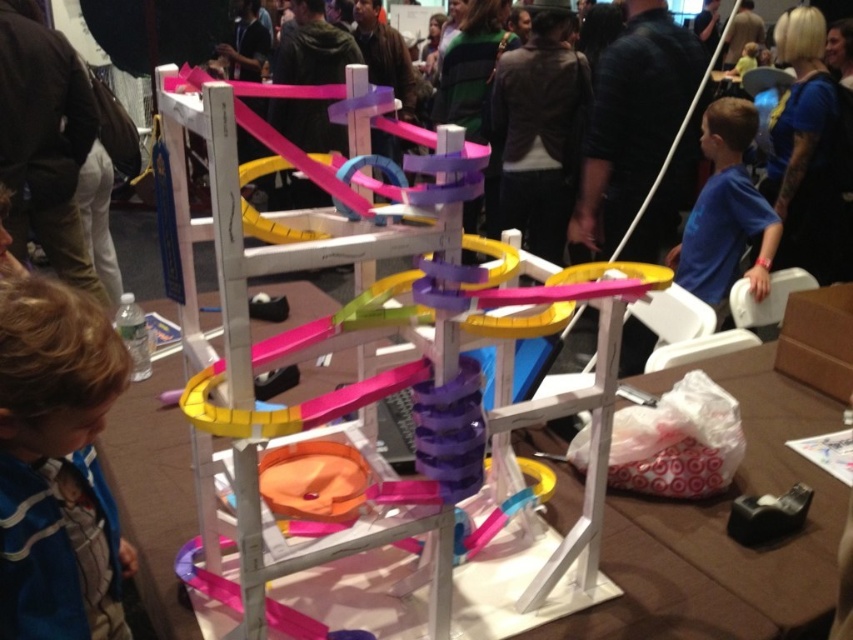
Is translucent plastic track at center below blue matte shirt at right?

Indeed, translucent plastic track at center is positioned under blue matte shirt at right.

Which is in front, point (552, 296) or point (775, 250)?

Point (552, 296) is more forward.

This screenshot has width=853, height=640. I want to click on translucent plastic track at center, so click(289, 362).

Does translucent plastic track at center appear under blue striped shirt at lower left?

No, translucent plastic track at center is not below blue striped shirt at lower left.

This screenshot has width=853, height=640. What do you see at coordinates (289, 362) in the screenshot?
I see `translucent plastic track at center` at bounding box center [289, 362].

The image size is (853, 640). In order to click on translucent plastic track at center in this screenshot , I will do `click(289, 362)`.

Does blue striped shirt at lower left appear under blue matte shirt at right?

Yes, blue striped shirt at lower left is below blue matte shirt at right.

Which of these two, blue striped shirt at lower left or blue matte shirt at right, stands shorter?

blue striped shirt at lower left is shorter.

The height and width of the screenshot is (640, 853). What do you see at coordinates (57, 465) in the screenshot?
I see `blue striped shirt at lower left` at bounding box center [57, 465].

What are the coordinates of `blue striped shirt at lower left` in the screenshot? It's located at (57, 465).